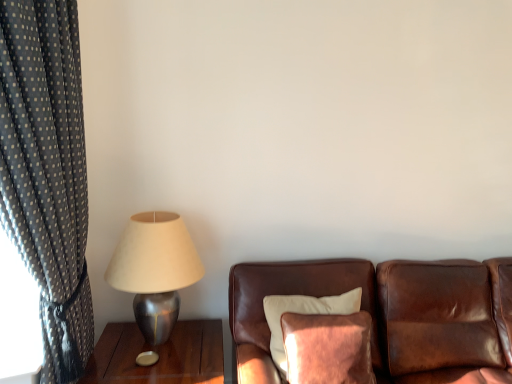
Where is `brown leather couch at center`? brown leather couch at center is located at coordinates (391, 315).

What do you see at coordinates (47, 173) in the screenshot? I see `dark gray polka dot fabric at left` at bounding box center [47, 173].

Where is `brown leather couch at center`? Image resolution: width=512 pixels, height=384 pixels. brown leather couch at center is located at coordinates (391, 315).

Which object is further away from the camera taking this photo, metallic silver table at left or velvet brown pillow at center?

metallic silver table at left.

Do you think metallic silver table at left is within velvet brown pillow at center, or outside of it?

metallic silver table at left is outside velvet brown pillow at center.

From a real-world perspective, which object rests below the other?

From a 3D spatial view, metallic silver table at left is below.

Considering the sizes of metallic silver table at left and velvet brown pillow at center in the image, is metallic silver table at left taller or shorter than velvet brown pillow at center?

Answer: In the image, metallic silver table at left appears to be shorter than velvet brown pillow at center.

Which of these two, brown leather couch at center or dark gray polka dot fabric at left, stands shorter?

With less height is brown leather couch at center.

Which object is positioned more to the right, brown leather couch at center or dark gray polka dot fabric at left?

Positioned to the right is brown leather couch at center.

Considering the relative sizes of brown leather couch at center and dark gray polka dot fabric at left in the image provided, is brown leather couch at center wider than dark gray polka dot fabric at left?

Yes, brown leather couch at center is wider than dark gray polka dot fabric at left.

Can you tell me how much velvet brown pillow at center and metallic silver lamp at left differ in facing direction?

velvet brown pillow at center and metallic silver lamp at left are facing 0.000156 degrees away from each other.

Are velvet brown pillow at center and metallic silver lamp at left located far from each other?

No, velvet brown pillow at center is not far from metallic silver lamp at left.

Is point (285, 376) farther from camera compared to point (145, 269)?

No, it is in front of (145, 269).

Is velvet brown pillow at center taller or shorter than metallic silver lamp at left?

velvet brown pillow at center is shorter than metallic silver lamp at left.

Locate an element on the screen. Image resolution: width=512 pixels, height=384 pixels. table below the metallic silver lamp at left (from a real-world perspective) is located at coordinates (159, 355).

Is point (183, 351) closer or farther from the camera than point (192, 248)?

Point (183, 351) is positioned closer to the camera compared to point (192, 248).

Between metallic silver table at left and metallic silver lamp at left, which one appears on the left side from the viewer's perspective?

metallic silver lamp at left is more to the left.

From the picture: Considering the relative sizes of velvet brown pillow at center and brown leather couch at center in the image provided, is velvet brown pillow at center bigger than brown leather couch at center?

Actually, velvet brown pillow at center might be smaller than brown leather couch at center.

This screenshot has height=384, width=512. In the image, there is a brown leather couch at center. In order to click on pillow above it (from the image's perspective) in this screenshot , I will do `click(301, 317)`.

Would you say velvet brown pillow at center is inside or outside brown leather couch at center?

velvet brown pillow at center is contained in brown leather couch at center.

How distant is metallic silver lamp at left from velvet brown pillow at center?

The distance of metallic silver lamp at left from velvet brown pillow at center is 21.58 inches.

Considering the relative sizes of metallic silver lamp at left and velvet brown pillow at center in the image provided, is metallic silver lamp at left wider than velvet brown pillow at center?

Correct, the width of metallic silver lamp at left exceeds that of velvet brown pillow at center.

Which is correct: metallic silver lamp at left is inside velvet brown pillow at center, or outside of it?

metallic silver lamp at left is spatially situated outside velvet brown pillow at center.

Locate an element on the screen. Image resolution: width=512 pixels, height=384 pixels. lamp located on the left of velvet brown pillow at center is located at coordinates click(x=155, y=270).

Who is bigger, velvet brown pillow at center or dark gray polka dot fabric at left?

dark gray polka dot fabric at left is bigger.

From a real-world perspective, between velvet brown pillow at center and dark gray polka dot fabric at left, who is vertically lower?

velvet brown pillow at center is physically lower.

Is velvet brown pillow at center facing away from dark gray polka dot fabric at left?

No.

From the image's perspective, does velvet brown pillow at center appear lower than dark gray polka dot fabric at left?

Yes.

I want to click on pillow in front of the metallic silver table at left, so click(x=301, y=317).

Find the location of a particular element. The width and height of the screenshot is (512, 384). studio couch below the dark gray polka dot fabric at left (from a real-world perspective) is located at coordinates (391, 315).

Which object lies further to the anchor point brown leather couch at center, metallic silver table at left or dark gray polka dot fabric at left?

The object further to brown leather couch at center is dark gray polka dot fabric at left.

Which object lies further to the anchor point dark gray polka dot fabric at left, brown leather couch at center or metallic silver lamp at left?

brown leather couch at center lies further to dark gray polka dot fabric at left than the other object.

Looking at the image, which one is located closer to dark gray polka dot fabric at left, metallic silver lamp at left or velvet brown pillow at center?

metallic silver lamp at left is positioned closer to the anchor dark gray polka dot fabric at left.

Which object lies further to the anchor point brown leather couch at center, velvet brown pillow at center or metallic silver table at left?

Among the two, metallic silver table at left is located further to brown leather couch at center.

When comparing their distances from dark gray polka dot fabric at left, does velvet brown pillow at center or metallic silver table at left seem further?

velvet brown pillow at center is further to dark gray polka dot fabric at left.

Considering their positions, is velvet brown pillow at center positioned closer to brown leather couch at center than metallic silver lamp at left?

Based on the image, velvet brown pillow at center appears to be nearer to brown leather couch at center.

Based on their spatial positions, is metallic silver lamp at left or metallic silver table at left further from brown leather couch at center?

metallic silver lamp at left lies further to brown leather couch at center than the other object.

Considering their positions, is metallic silver table at left positioned closer to velvet brown pillow at center than metallic silver lamp at left?

metallic silver table at left is positioned closer to the anchor velvet brown pillow at center.

You are a GUI agent. You are given a task and a screenshot of the screen. Output one action in this format:
    pyautogui.click(x=<x>, y=<y>)
    Task: Click on the table situated between dark gray polka dot fabric at left and brown leather couch at center from left to right
    This screenshot has height=384, width=512.
    Given the screenshot: What is the action you would take?
    pyautogui.click(x=159, y=355)

Identify the location of lamp located between dark gray polka dot fabric at left and brown leather couch at center in the left-right direction. The image size is (512, 384). coord(155,270).

Find the location of a particular element. The image size is (512, 384). table located between dark gray polka dot fabric at left and velvet brown pillow at center in the left-right direction is located at coordinates (159, 355).

The width and height of the screenshot is (512, 384). I want to click on pillow between metallic silver table at left and brown leather couch at center, so click(x=301, y=317).